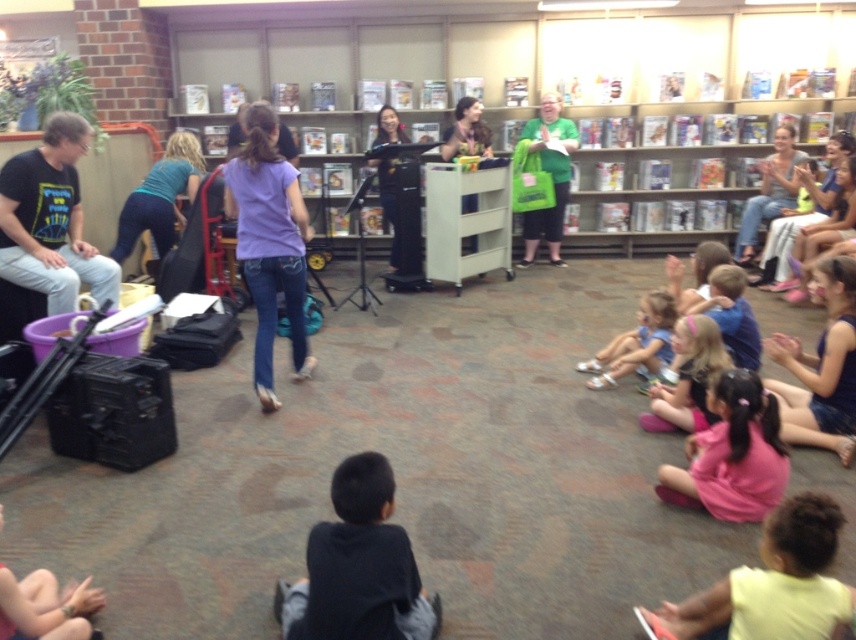
Question: Can you confirm if light yellow shirt at lower right is smaller than wooden bookshelf at upper center?

Choices:
 (A) no
 (B) yes

Answer: (B)

Question: Can you confirm if purple denim jeans at center is smaller than wooden bookshelf at upper center?

Choices:
 (A) yes
 (B) no

Answer: (A)

Question: From the image, what is the correct spatial relationship of wooden bookshelf at upper center in relation to light blue denim shorts at lower right?

Choices:
 (A) below
 (B) above

Answer: (B)

Question: Which point is closer to the camera?

Choices:
 (A) (676, 627)
 (B) (293, 344)
 (C) (366, 609)

Answer: (C)

Question: Estimate the real-world distances between objects in this image. Which object is closer to the black fabric at lower center?

Choices:
 (A) black t-shirt at left
 (B) pink fabric at lower right

Answer: (B)

Question: Estimate the real-world distances between objects in this image. Which object is closer to the purple denim jeans at center?

Choices:
 (A) pink fabric at lower right
 (B) light blue denim shorts at lower right
 (C) light yellow shirt at lower right

Answer: (B)